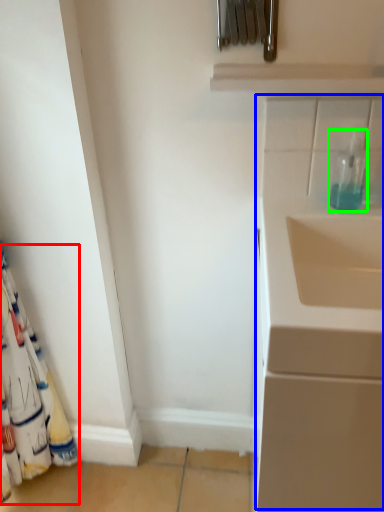
Question: Which object is the closest to the curtain (highlighted by a red box)? Choose among these: wide (highlighted by a blue box) or bottle (highlighted by a green box).

Choices:
 (A) wide
 (B) bottle

Answer: (A)